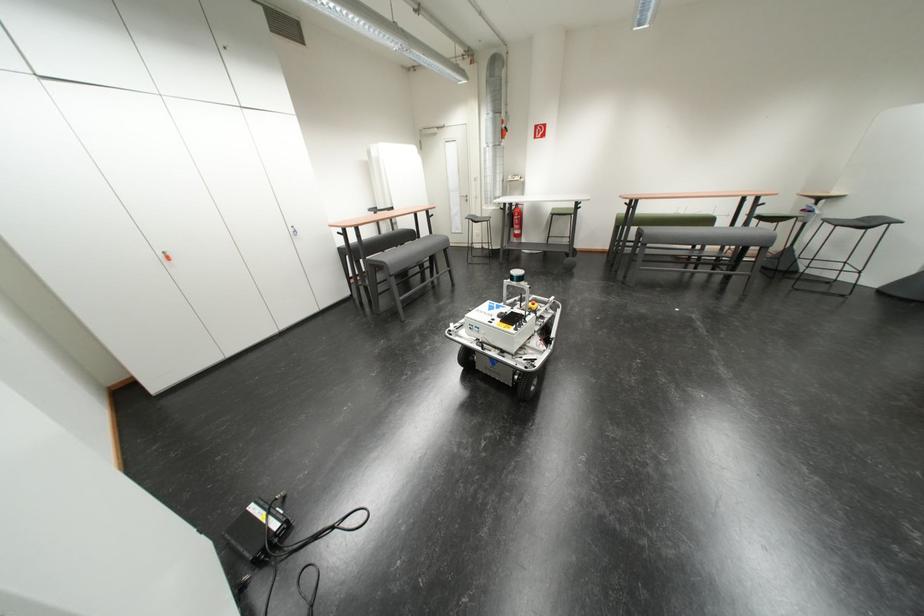
The height and width of the screenshot is (616, 924). What are the coordinates of `door handle` in the screenshot? It's located at (294, 231).